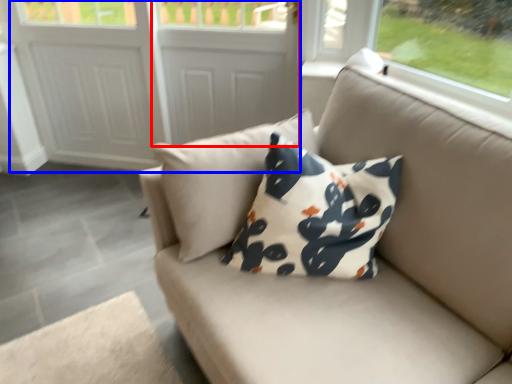
Question: Which object is further to the camera taking this photo, screen door (highlighted by a red box) or screen door (highlighted by a blue box)?

Choices:
 (A) screen door
 (B) screen door

Answer: (B)